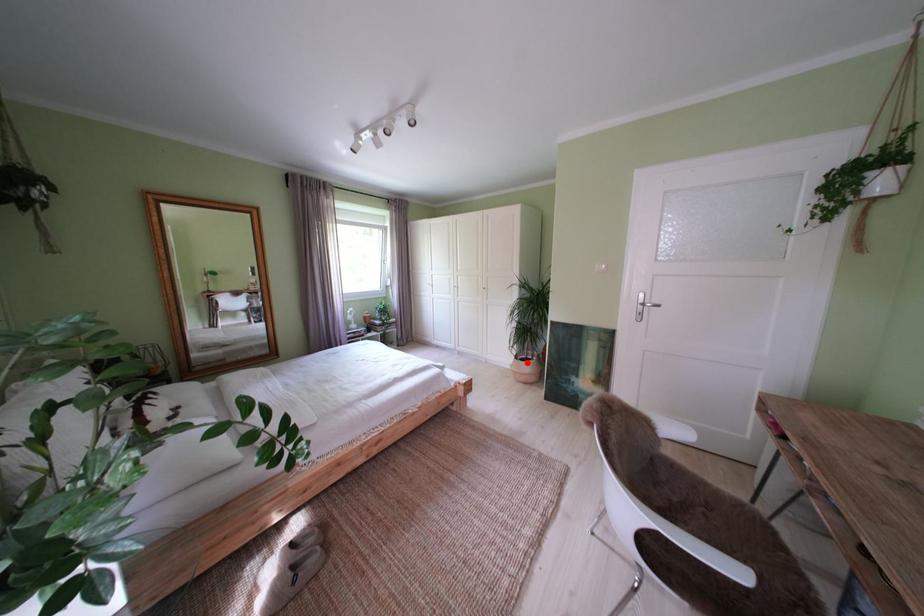
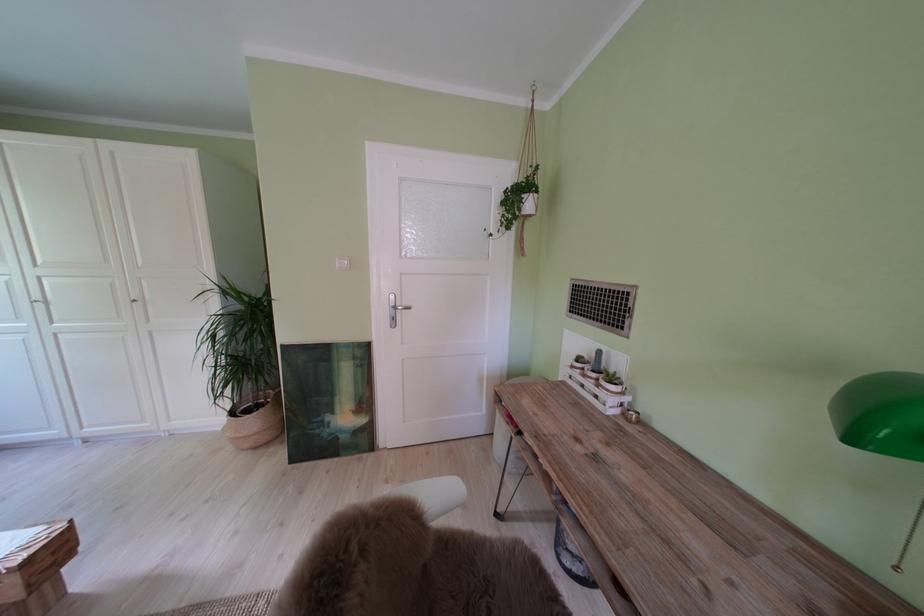
Where in the second image is the point corresponding to the highlighted location from the first image?

(242, 418)